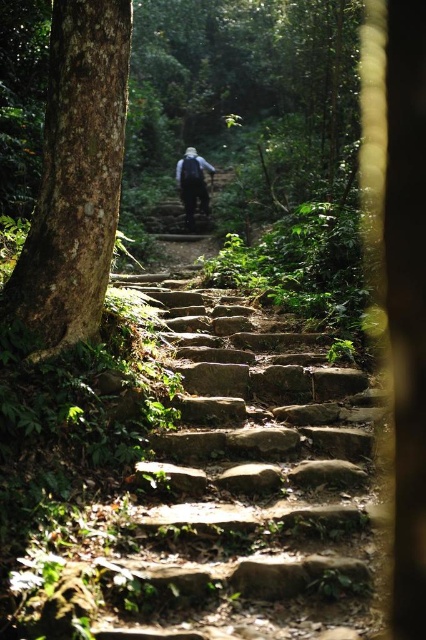
Question: Is smooth brown tree trunk at left bigger than dark blue fabric backpack at center?

Choices:
 (A) no
 (B) yes

Answer: (A)

Question: Among these points, which one is farthest from the camera?

Choices:
 (A) (184, 529)
 (B) (86, 22)

Answer: (B)

Question: Is natural stone stairs at center in front of smooth brown tree trunk at left?

Choices:
 (A) no
 (B) yes

Answer: (B)

Question: Which object appears farthest from the camera in this image?

Choices:
 (A) natural stone stairs at center
 (B) dark blue fabric backpack at center

Answer: (B)

Question: Does natural stone stairs at center appear over smooth brown tree trunk at left?

Choices:
 (A) yes
 (B) no

Answer: (B)

Question: Among these points, which one is nearest to the camera?

Choices:
 (A) (x=95, y=150)
 (B) (x=311, y=403)

Answer: (A)